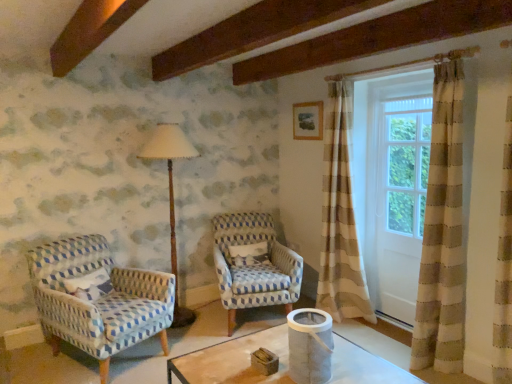
Question: From the image's perspective, is blue and white woven chair at center, arranged as the 1th chair when viewed from the right, over white fabric curtain at right?

Choices:
 (A) no
 (B) yes

Answer: (A)

Question: Is white fabric curtain at right completely or partially inside blue and white woven chair at center, which appears as the 2th chair when viewed from the left?

Choices:
 (A) yes
 (B) no

Answer: (B)

Question: Is blue and white woven chair at center, which appears as the 2th chair when viewed from the left, next to white fabric curtain at right and touching it?

Choices:
 (A) yes
 (B) no

Answer: (B)

Question: Could you tell me if blue and white woven chair at center, which appears as the 2th chair when viewed from the left, is turned towards white fabric curtain at right?

Choices:
 (A) yes
 (B) no

Answer: (B)

Question: Is blue and white woven chair at center, arranged as the 1th chair when viewed from the right, not near white fabric curtain at right?

Choices:
 (A) yes
 (B) no

Answer: (B)

Question: Is blue and white woven chair at center, arranged as the 1th chair when viewed from the right, further to the viewer compared to white fabric curtain at right?

Choices:
 (A) no
 (B) yes

Answer: (B)

Question: Considering the relative sizes of white fabric curtain at right and wooden floor lamp at left in the image provided, is white fabric curtain at right smaller than wooden floor lamp at left?

Choices:
 (A) yes
 (B) no

Answer: (A)

Question: From the image's perspective, does white fabric curtain at right appear lower than wooden floor lamp at left?

Choices:
 (A) no
 (B) yes

Answer: (A)

Question: Can you confirm if white fabric curtain at right is bigger than wooden floor lamp at left?

Choices:
 (A) yes
 (B) no

Answer: (B)

Question: Is white fabric curtain at right directly adjacent to wooden floor lamp at left?

Choices:
 (A) yes
 (B) no

Answer: (B)

Question: From a real-world perspective, does white fabric curtain at right sit lower than wooden floor lamp at left?

Choices:
 (A) yes
 (B) no

Answer: (B)

Question: Can you confirm if white fabric curtain at right is wider than wooden floor lamp at left?

Choices:
 (A) yes
 (B) no

Answer: (B)

Question: Can you confirm if wooden picture frame at upper center is shorter than white fabric curtain at right?

Choices:
 (A) yes
 (B) no

Answer: (A)